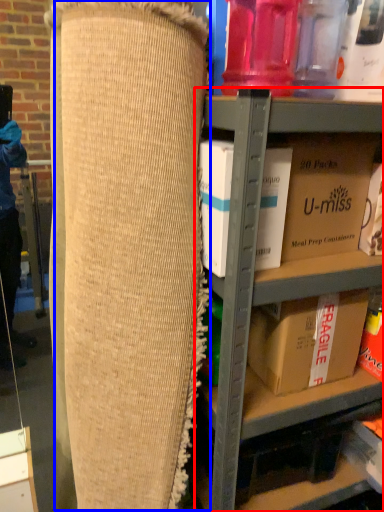
Question: Which object appears farthest to the camera in this image, shelf (highlighted by a red box) or bean bag chair (highlighted by a blue box)?

Choices:
 (A) shelf
 (B) bean bag chair

Answer: (A)